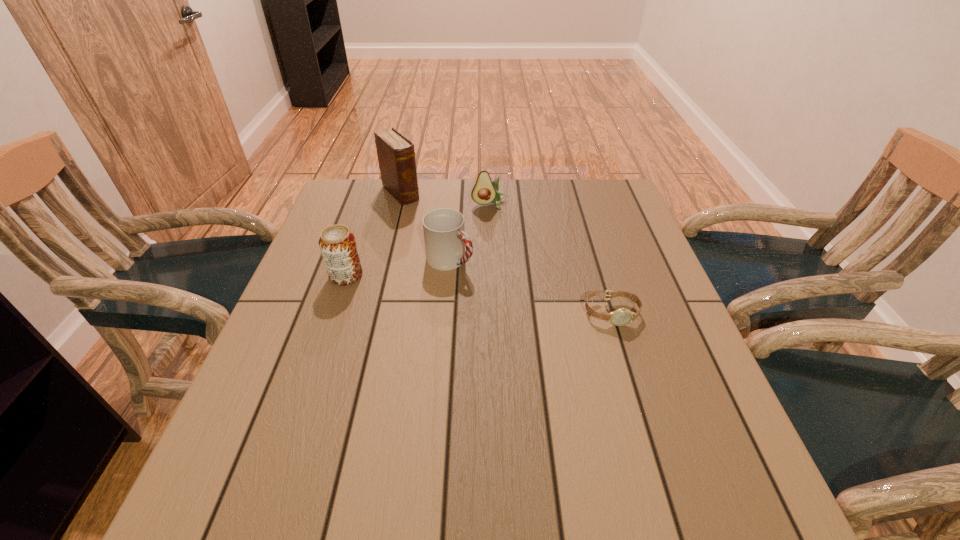
You are a GUI agent. You are given a task and a screenshot of the screen. Output one action in this format:
    pyautogui.click(x=<x>, y=<y>)
    Task: Click on the diary that is at the left edge
    The image size is (960, 540).
    Given the screenshot: What is the action you would take?
    396,156

Find the location of a particular element. The width and height of the screenshot is (960, 540). object that is at the right edge is located at coordinates (620, 317).

This screenshot has width=960, height=540. What are the coordinates of `object that is at the far left corner` in the screenshot? It's located at (396, 156).

In the image, there is a desktop. In order to click on vacant space at the far edge in this screenshot , I will do `click(443, 185)`.

Identify the location of vacant space at the near edge of the desktop. (520, 435).

In the image, there is a desktop. At what (x,y) coordinates should I click in order to perform the action: click on vacant space at the left edge. Please return your answer as a coordinate pair (x, y). Looking at the image, I should click on (348, 295).

Image resolution: width=960 pixels, height=540 pixels. What are the coordinates of `blank area at the right edge` in the screenshot? It's located at (611, 280).

This screenshot has height=540, width=960. I want to click on vacant area at the far right corner, so click(x=601, y=219).

The height and width of the screenshot is (540, 960). What are the coordinates of `vacant space that is in between the shortest object and the tallest object` in the screenshot? It's located at (506, 253).

At what (x,y) coordinates should I click in order to perform the action: click on blank region between the beer can and the shortest object. Please return your answer as a coordinate pair (x, y). Looking at the image, I should click on (479, 294).